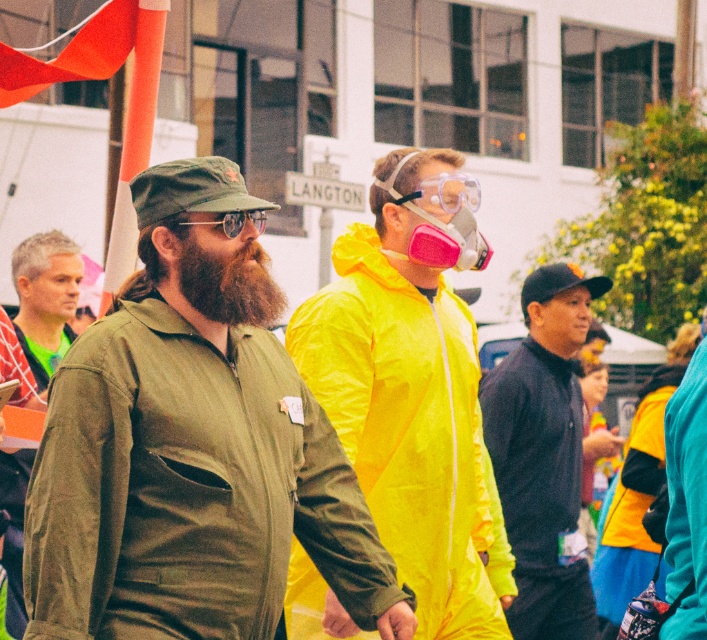
You are standing in the crowd at this event and want to take a photo of both the person in the green military jacket and the person in the yellow raincoat. Which of the two points, point (x=467, y=349) or point (x=392, y=193), should you focus on first to ensure both subjects are in clear view?

Point (x=467, y=349) is further to the viewer than point (x=392, y=193). To ensure both subjects are in clear view, focus on point (x=467, y=349) first since it is closer to you, allowing the camera to adjust focus for the nearer subject before considering the farther one.

You are a photographer trying to capture both the neon yellow raincoat at center and the pink matte gas mask at center in a single frame. Since the camera can only focus on one subject at a time, which object should you focus on first to ensure both are in the frame?

The neon yellow raincoat at center is to the left of pink matte gas mask at center. Since the camera can only focus on one subject at a time, you should focus on the neon yellow raincoat at center first because it is closer to the left edge of the frame, allowing the pink matte gas mask at center to remain within the frame when adjusting focus.

In the scene shown: You are a photographer trying to capture the perfect shot of the matte green jacket at left and the bright yellow raincoat next to them. Given that the matte green jacket at left is exactly at point (45, 300), where should you position your camera to ensure both subjects are in frame?

To capture both the matte green jacket at left and the bright yellow raincoat next to them, position the camera so that the matte green jacket at left is centered at point (45, 300). This ensures the jacket is in focus while the raincoat remains within the frame.